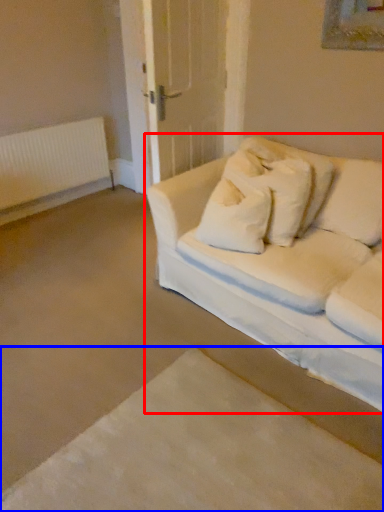
Question: Which object appears closest to the camera in this image, studio couch (highlighted by a red box) or bed frame (highlighted by a blue box)?

Choices:
 (A) studio couch
 (B) bed frame

Answer: (B)